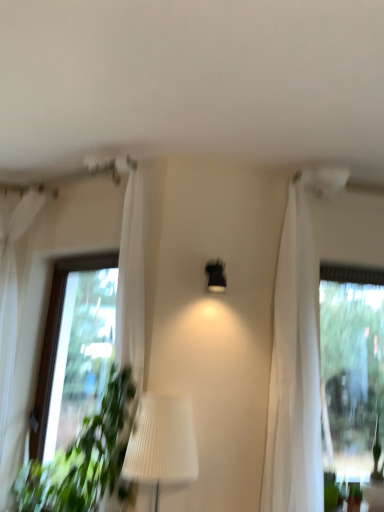
Question: Considering the positions of matte black lamp at center and white sheer curtain at left in the image, is matte black lamp at center bigger or smaller than white sheer curtain at left?

Choices:
 (A) small
 (B) big

Answer: (A)

Question: Is matte black lamp at center inside the boundaries of white sheer curtain at left, or outside?

Choices:
 (A) inside
 (B) outside

Answer: (B)

Question: From a real-world perspective, relative to white sheer curtain at left, is matte black lamp at center vertically above or below?

Choices:
 (A) below
 (B) above

Answer: (B)

Question: From their relative heights in the image, would you say white sheer curtain at left is taller or shorter than matte black lamp at center?

Choices:
 (A) tall
 (B) short

Answer: (A)

Question: Which is correct: white sheer curtain at left is inside matte black lamp at center, or outside of it?

Choices:
 (A) inside
 (B) outside

Answer: (B)

Question: Is white sheer curtain at left wider or thinner than matte black lamp at center?

Choices:
 (A) wide
 (B) thin

Answer: (A)

Question: From the image's perspective, is white sheer curtain at left above or below matte black lamp at center?

Choices:
 (A) above
 (B) below

Answer: (B)